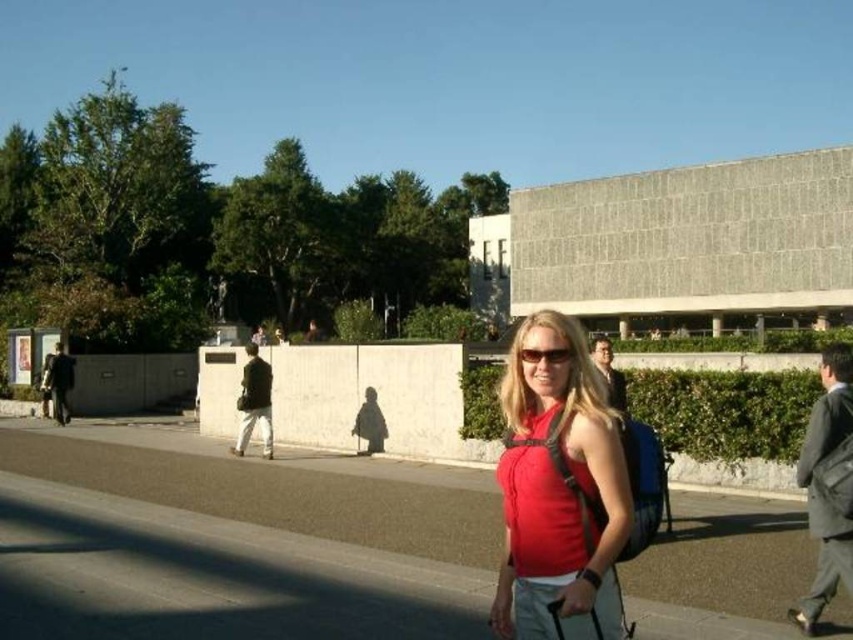
The image size is (853, 640). What do you see at coordinates (558, 490) in the screenshot?
I see `red matte tank top at center` at bounding box center [558, 490].

Is red matte tank top at center closer to the viewer compared to matte black sunglasses at center?

Yes, it is in front of matte black sunglasses at center.

You are a GUI agent. You are given a task and a screenshot of the screen. Output one action in this format:
    pyautogui.click(x=<x>, y=<y>)
    Task: Click on the red matte tank top at center
    The height and width of the screenshot is (640, 853).
    Given the screenshot: What is the action you would take?
    pyautogui.click(x=558, y=490)

Does point (392, 552) lie in front of point (532, 352)?

No, it is not.

Identify the location of gray asphalt pavement at center. Image resolution: width=853 pixels, height=640 pixels. coord(231,544).

Is gray asphalt pavement at center positioned at the back of red matte tank top at center?

Yes, it is.

Can you confirm if gray asphalt pavement at center is shorter than red matte tank top at center?

Yes, gray asphalt pavement at center is shorter than red matte tank top at center.

Find the location of `gray asphalt pavement at center`. gray asphalt pavement at center is located at coordinates (231, 544).